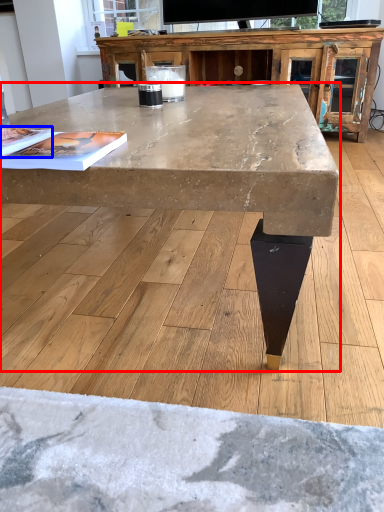
Question: Which of the following is the closest to the observer, coffee table (highlighted by a red box) or magazine (highlighted by a blue box)?

Choices:
 (A) coffee table
 (B) magazine

Answer: (A)